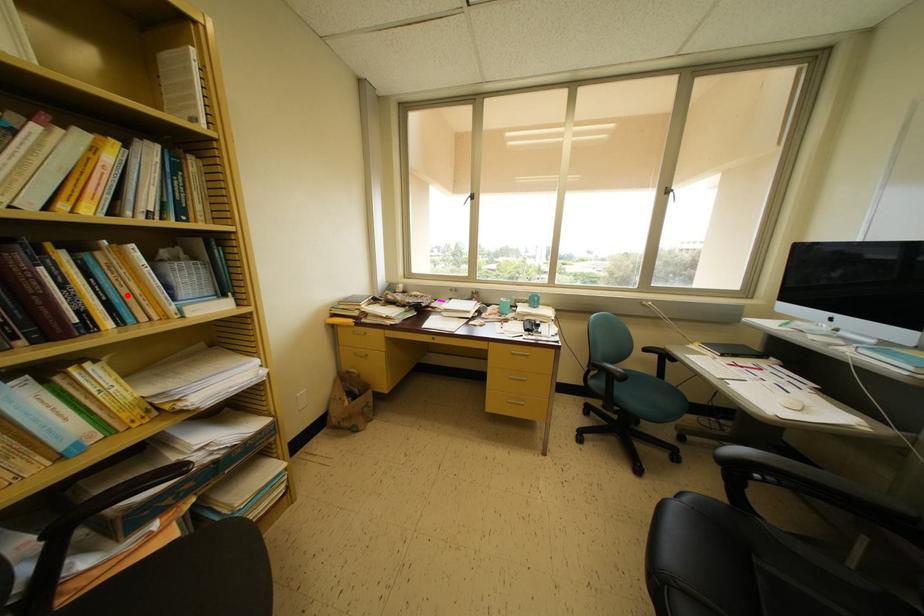
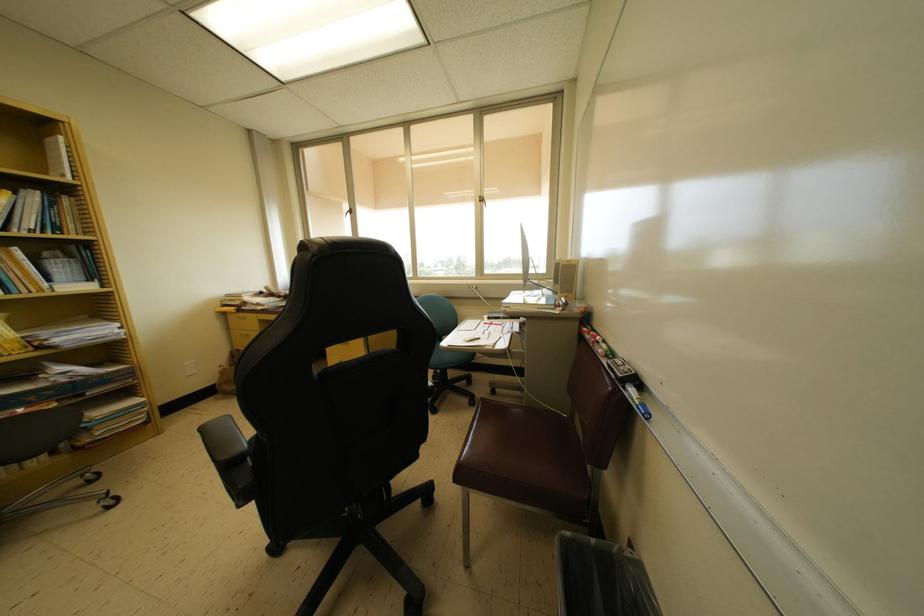
Where in the second image is the point corresponding to the highlighted location from the first image?

(15, 278)